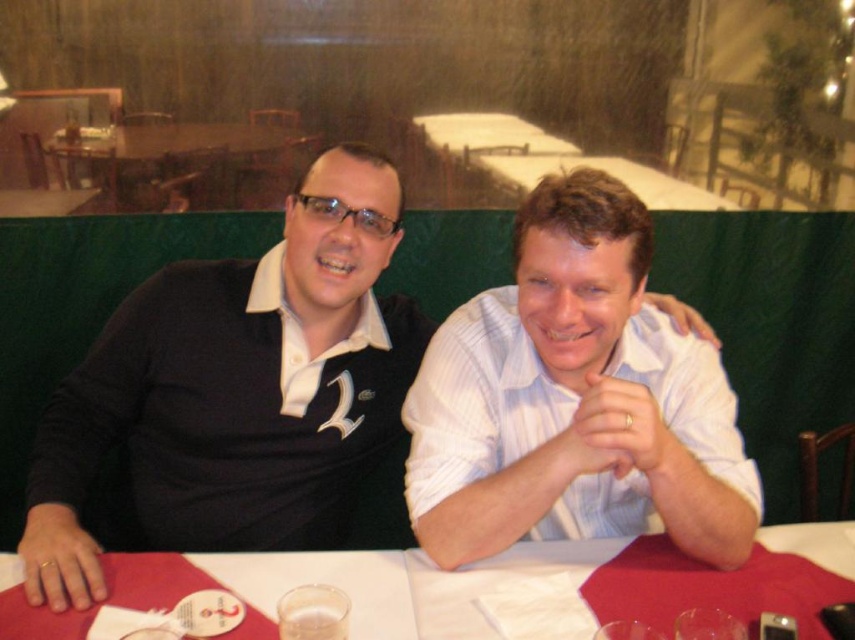
You are a server in a restaurant. You need to place a new menu on the table between the white paper at center and the white matte hand at upper center. Where should you place the new menu?

The white paper at center is to the left of the white matte hand at upper center, so you should place the new menu between them by positioning it to the right of the white paper at center and to the left of the white matte hand at upper center.

What are the coordinates of the black matte shirt at center in the image?

The black matte shirt at center is located at coordinates point (249, 378).